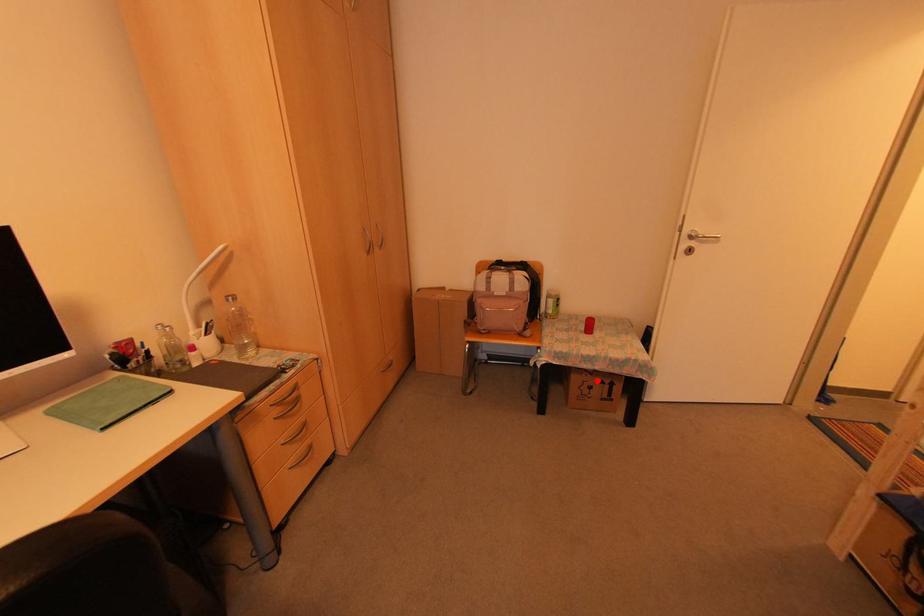
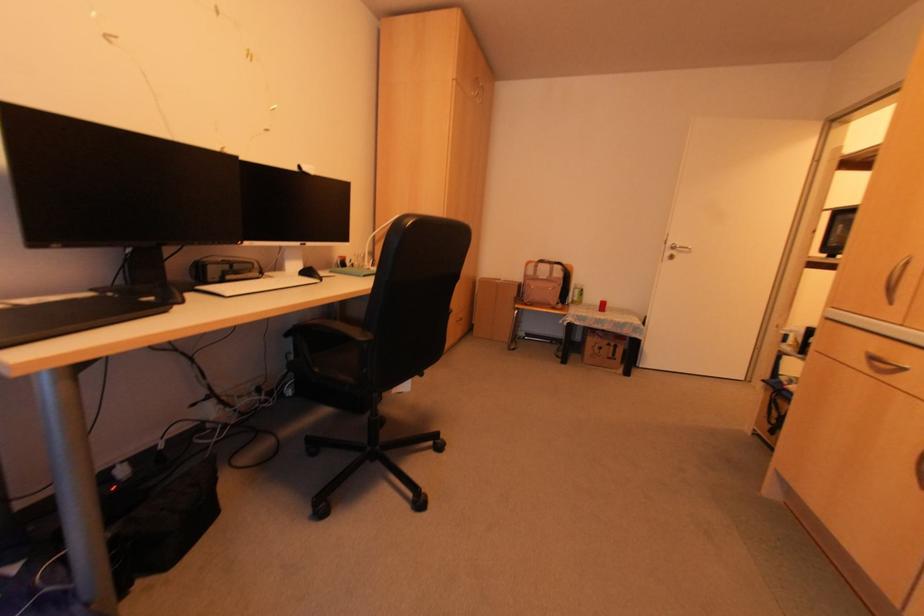
Question: I am providing you with two images of the same scene from different viewpoints. Given a red point in image1, look at the same physical point in image2. Is it:

Choices:
 (A) Closer to the viewpoint
 (B) Farther from the viewpoint

Answer: (A)